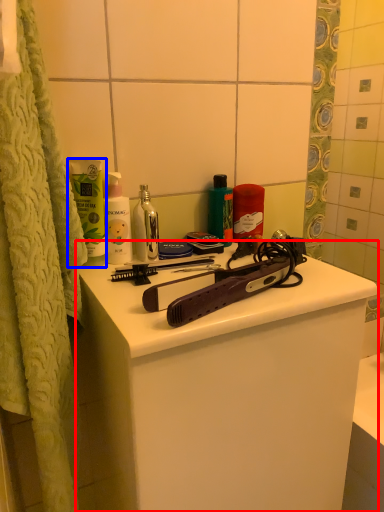
Question: Which object is further to the camera taking this photo, bathroom cabinet (highlighted by a red box) or mouthwash (highlighted by a blue box)?

Choices:
 (A) bathroom cabinet
 (B) mouthwash

Answer: (B)